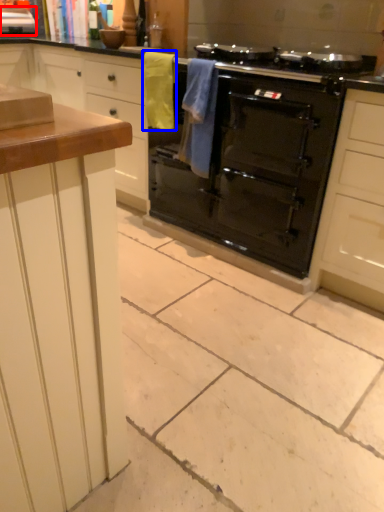
Question: Among these objects, which one is farthest to the camera, appliance (highlighted by a red box) or material (highlighted by a blue box)?

Choices:
 (A) appliance
 (B) material

Answer: (A)